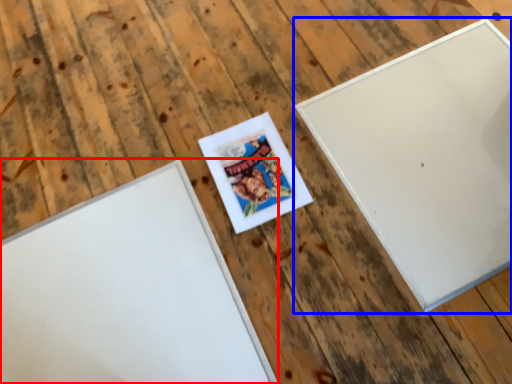
Question: Which point is closer to the camera, picture frame (highlighted by a red box) or picture frame (highlighted by a blue box)?

Choices:
 (A) picture frame
 (B) picture frame

Answer: (A)